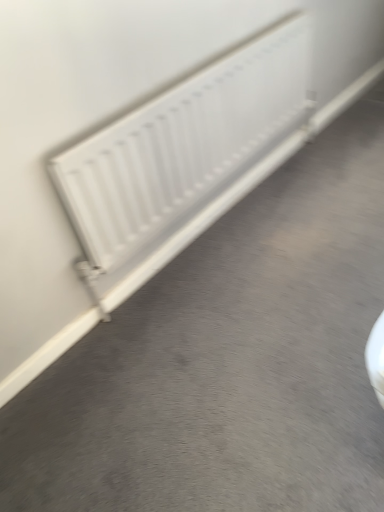
Find the location of a particular element. This screenshot has width=384, height=512. free spot in front of white matte radiator at center is located at coordinates (233, 321).